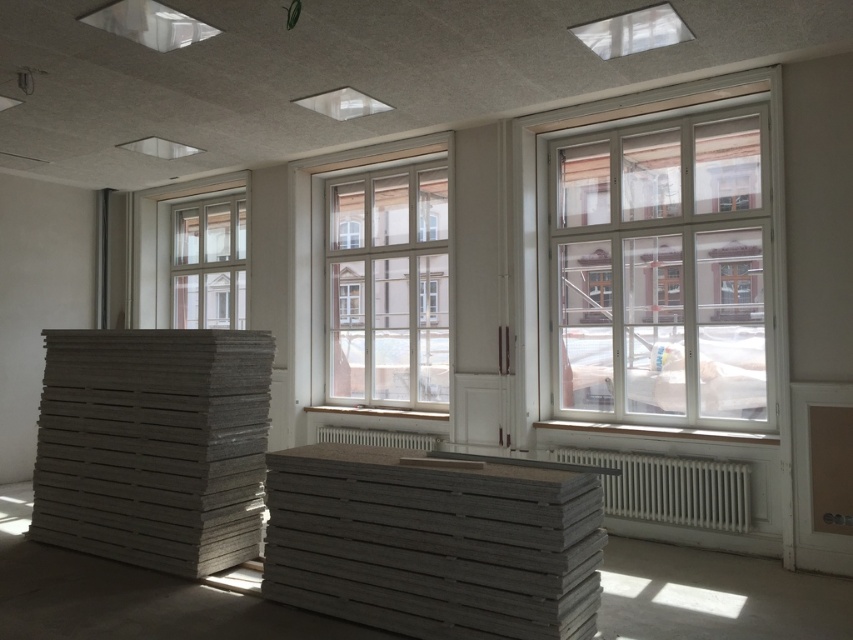
Is white glass window at right below gray matte palette at center?

No.

Does point (717, 381) come farther from viewer compared to point (403, 464)?

That is True.

Is point (556, 307) behind point (404, 458)?

Yes, it is.

Identify the location of white glass window at right. Image resolution: width=853 pixels, height=640 pixels. (659, 272).

Is white glass window at center wider than clear glass window at upper left?

Yes, white glass window at center is wider than clear glass window at upper left.

Does white glass window at center lie in front of clear glass window at upper left?

Yes, white glass window at center is in front of clear glass window at upper left.

The image size is (853, 640). What do you see at coordinates (387, 285) in the screenshot?
I see `white glass window at center` at bounding box center [387, 285].

Identify the location of white glass window at center. (387, 285).

Does white glass window at right have a smaller size compared to gray matte lumber at center?

Incorrect, white glass window at right is not smaller in size than gray matte lumber at center.

Does white glass window at right have a lesser height compared to gray matte lumber at center?

Incorrect, white glass window at right's height does not fall short of gray matte lumber at center's.

At what (x,y) coordinates should I click in order to perform the action: click on white glass window at right. Please return your answer as a coordinate pair (x, y). This screenshot has width=853, height=640. Looking at the image, I should click on (659, 272).